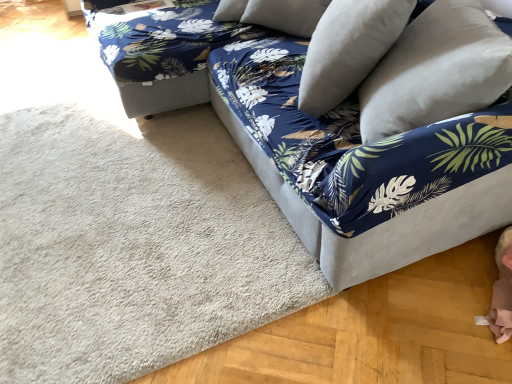
What are the coordinates of `free space underneath beige carpet at lower left (from a real-world perspective)` in the screenshot? It's located at (111, 196).